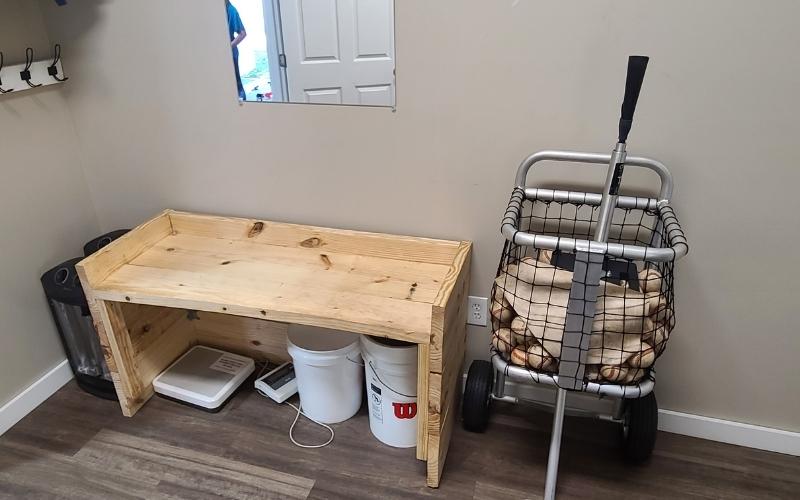
This screenshot has height=500, width=800. Identify the location of bucket. (318, 399).